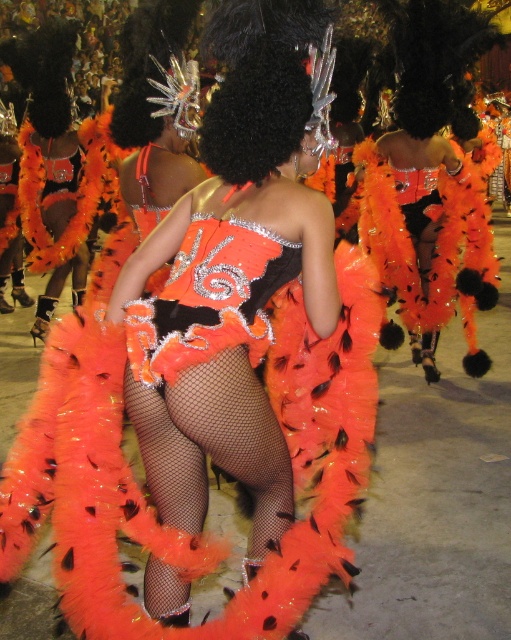
You are standing in the middle of the parade watching the performers. You notice two points in the image, one at coordinates point (144, 324) and the other at point (33, 76). Which point is closer to you?

Point (144, 324) is closer to the viewer than point (33, 76).

You are a photographer trying to capture the performers in the parade. You notice the orange feathered costume at center and the orange feather boa at center. Which one appears narrower when viewed from your position?

The orange feathered costume at center is thinner than the orange feather boa at center, so the orange feathered costume at center appears narrower.

You are a photographer positioned at the origin point of the image coordinate system. You want to capture a photo of the orange feathered costume at center. What are the coordinates where you should aim your camera?

The orange feathered costume at center is located at coordinates point (x=234, y=291), so you should aim your camera at those coordinates to capture it.